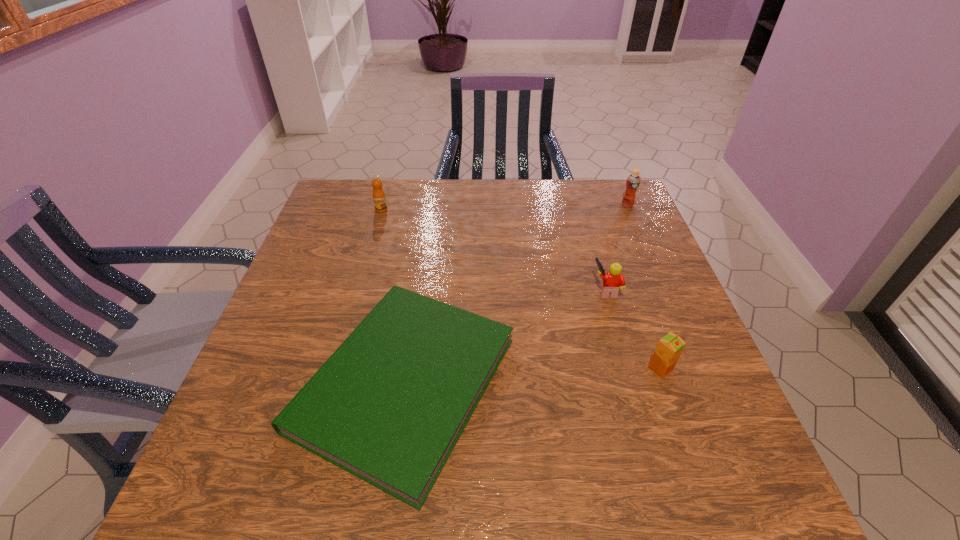
Identify the location of vacant space located in front of the Lego with the accessory visible. (552, 290).

At what (x,y) coordinates should I click in order to perform the action: click on vacant space located on the front of the second orange juice from left to right. Please return your answer as a coordinate pair (x, y). Looking at the image, I should click on (703, 485).

Identify the location of free space located on the back of the shortest object. This screenshot has height=540, width=960. 429,211.

Locate an element on the screen. object situated at the near edge is located at coordinates (389, 405).

Find the location of a particular element. The image size is (960, 540). orange juice that is positioned at the left edge is located at coordinates (379, 198).

Locate an element on the screen. The height and width of the screenshot is (540, 960). paperback book present at the left edge is located at coordinates (389, 405).

At what (x,y) coordinates should I click in order to perform the action: click on Lego positioned at the right edge. Please return your answer as a coordinate pair (x, y). Looking at the image, I should click on (613, 280).

Identify the location of object at the far left corner. (379, 198).

The height and width of the screenshot is (540, 960). Identify the location of object located in the near left corner section of the desktop. (389, 405).

Identify the location of object that is at the far right corner. (633, 181).